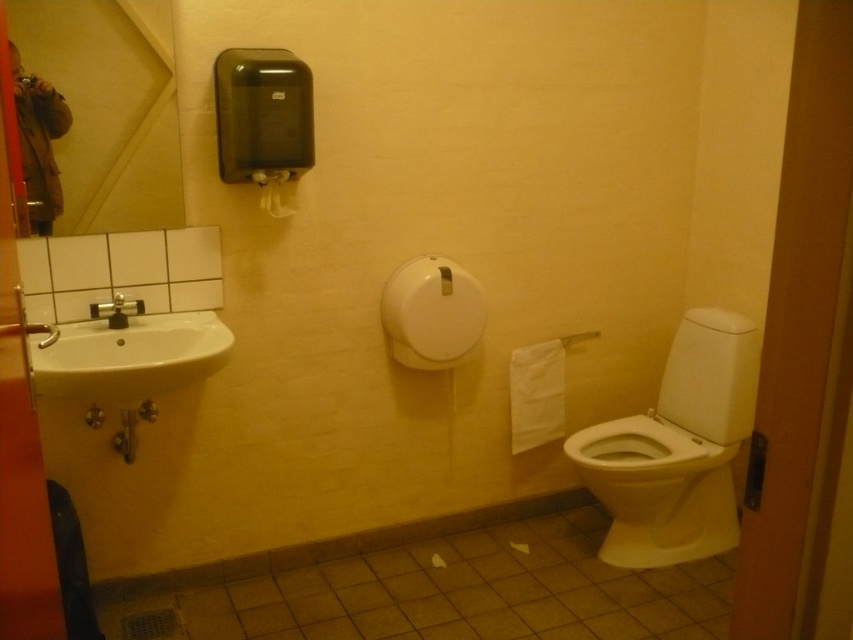
Question: Which point is closer to the camera taking this photo?

Choices:
 (A) (131, 330)
 (B) (277, 177)
 (C) (125, 314)

Answer: (A)

Question: Estimate the real-world distances between objects in this image. Which object is farther from the white glossy toilet at lower right?

Choices:
 (A) white ceramic sink at left
 (B) white matte toilet paper at upper center
 (C) matte silver faucet at left
 (D) brushed metal faucet at left

Answer: (D)

Question: Is white glossy toilet at lower right thinner than white ceramic sink at left?

Choices:
 (A) no
 (B) yes

Answer: (A)

Question: Which object is the farthest from the white paper towel at lower right?

Choices:
 (A) white matte toilet paper at upper center
 (B) matte silver faucet at left
 (C) brushed metal faucet at left

Answer: (C)

Question: Can you confirm if white paper towel at lower right is positioned above matte silver faucet at left?

Choices:
 (A) yes
 (B) no

Answer: (B)

Question: In this image, where is white ceramic sink at left located relative to white matte toilet paper at upper center?

Choices:
 (A) left
 (B) right

Answer: (A)